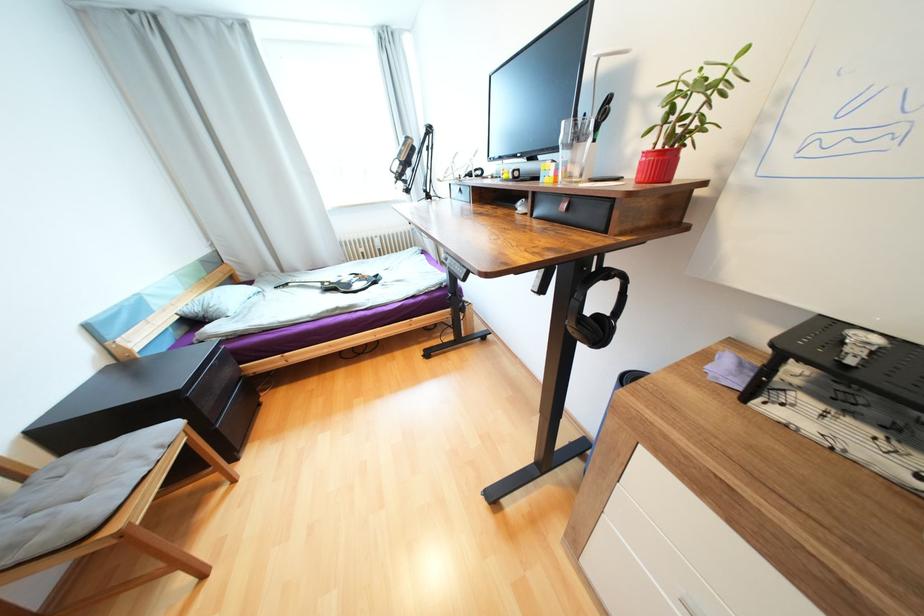
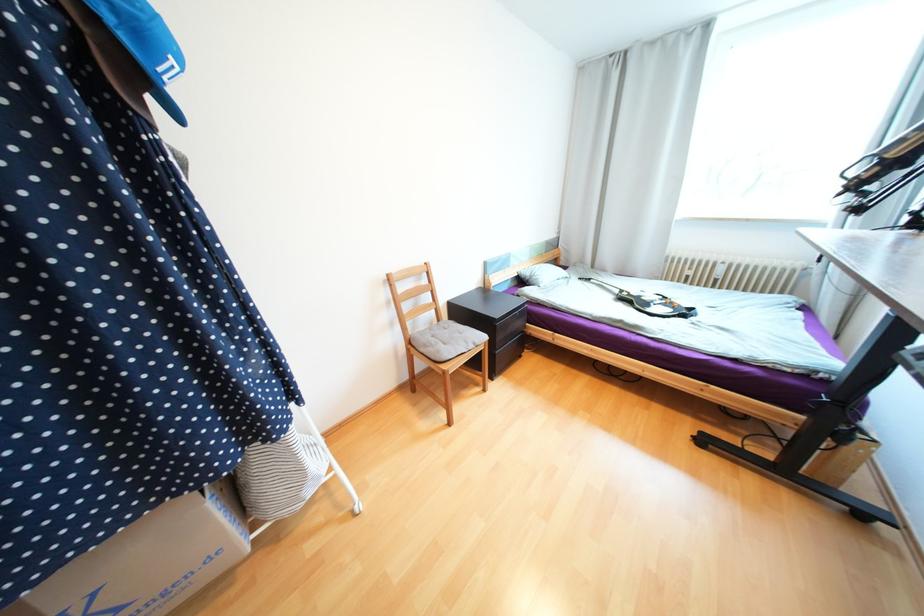
Locate, in the second image, the point that corresponds to point (325, 285) in the first image.

(623, 292)